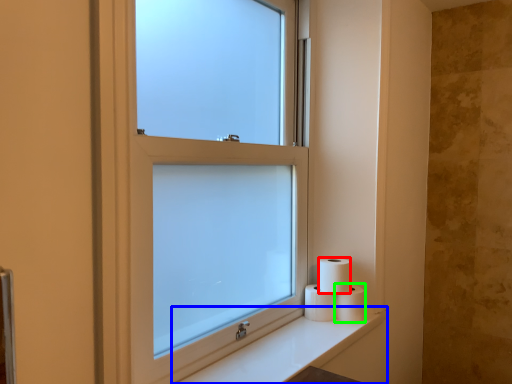
Question: Which object is positioned closest to toilet paper (highlighted by a red box)? Select from counter top (highlighted by a blue box) and toilet paper (highlighted by a green box).

Choices:
 (A) counter top
 (B) toilet paper

Answer: (B)